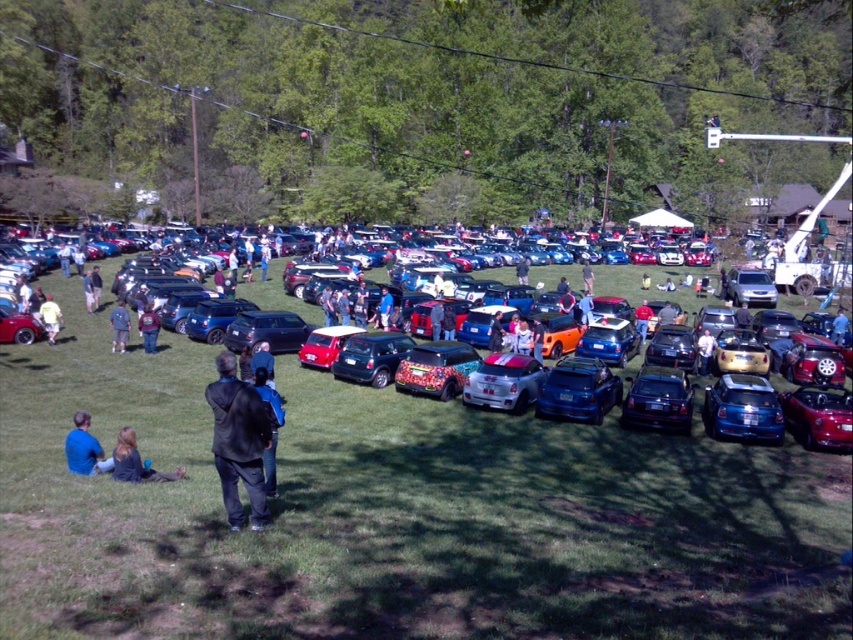
Question: In this image, where is black leather jacket at lower center located relative to denim jacket at lower left?

Choices:
 (A) right
 (B) left

Answer: (A)

Question: Which of the following is the closest to the observer?

Choices:
 (A) (775, 392)
 (B) (125, 449)

Answer: (B)

Question: Is glossy blue car at center bigger than maroon fabric shirt at center?

Choices:
 (A) no
 (B) yes

Answer: (B)

Question: Does blue fabric shirt at lower left appear over yellow shirt at center?

Choices:
 (A) yes
 (B) no

Answer: (B)

Question: Among these points, which one is farthest from the camera?

Choices:
 (A) (277, 416)
 (B) (170, 349)
 (C) (741, 404)
 (D) (711, 356)

Answer: (B)

Question: Which point is closer to the camera?

Choices:
 (A) glossy black car at center
 (B) blue fabric shirt at lower left
 (C) matte black car at center

Answer: (B)